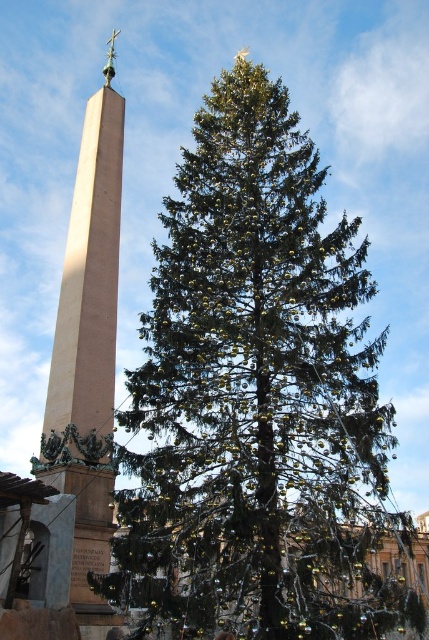
You are standing in a park and see the green textured pine tree at center and the smooth beige obelisk at left. If you walk straight ahead, which object will come into your view first?

The smooth beige obelisk at left will come into view first because it is positioned to the left of the green textured pine tree at center, meaning it is closer to your current position when facing the scene.

Based on the photo, you are standing in front of the festive scene and want to take a photo of the green textured pine tree at center and the smooth beige obelisk at left. Which object will appear larger in the photo?

The green textured pine tree at center will appear larger in the photo because it is positioned in front of the smooth beige obelisk at left, making it closer to the camera and thus appear bigger.

You are planning to take a photo of both the green textured pine tree at center and the smooth beige obelisk at left. Since you want both objects to be clearly visible in the frame, which one should you focus on first to ensure proper focus?

You should focus on the green textured pine tree at center first because it is bigger than the smooth beige obelisk at left, so it will require more precise focus to capture its details clearly.